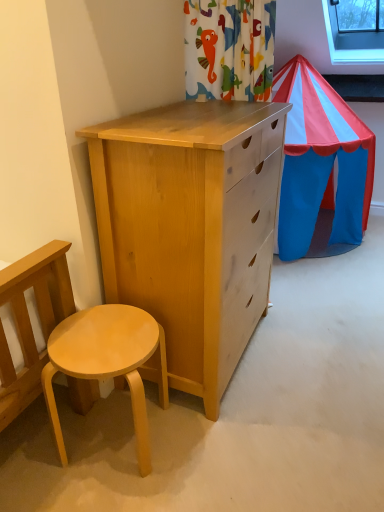
Question: Would you say light wood stool at lower left is a long distance from transparent glass window at upper right?

Choices:
 (A) no
 (B) yes

Answer: (B)

Question: Does light wood stool at lower left come in front of transparent glass window at upper right?

Choices:
 (A) yes
 (B) no

Answer: (A)

Question: Is light wood stool at lower left behind transparent glass window at upper right?

Choices:
 (A) no
 (B) yes

Answer: (A)

Question: Is light wood stool at lower left directly adjacent to transparent glass window at upper right?

Choices:
 (A) yes
 (B) no

Answer: (B)

Question: Does light wood stool at lower left have a greater width compared to transparent glass window at upper right?

Choices:
 (A) no
 (B) yes

Answer: (A)

Question: From a real-world perspective, is light wood stool at lower left physically below transparent glass window at upper right?

Choices:
 (A) no
 (B) yes

Answer: (B)

Question: Is transparent glass window at upper right positioned with its back to light wood stool at lower left?

Choices:
 (A) no
 (B) yes

Answer: (A)

Question: Considering the relative sizes of transparent glass window at upper right and light wood stool at lower left in the image provided, is transparent glass window at upper right wider than light wood stool at lower left?

Choices:
 (A) yes
 (B) no

Answer: (A)

Question: Considering the relative sizes of transparent glass window at upper right and light wood stool at lower left in the image provided, is transparent glass window at upper right smaller than light wood stool at lower left?

Choices:
 (A) yes
 (B) no

Answer: (B)

Question: From a real-world perspective, is transparent glass window at upper right located higher than light wood stool at lower left?

Choices:
 (A) no
 (B) yes

Answer: (B)

Question: Is the depth of transparent glass window at upper right greater than that of light wood stool at lower left?

Choices:
 (A) yes
 (B) no

Answer: (A)

Question: Is transparent glass window at upper right surrounding light wood stool at lower left?

Choices:
 (A) yes
 (B) no

Answer: (B)

Question: From the image's perspective, is transparent glass window at upper right located above or below light wood stool at lower left?

Choices:
 (A) below
 (B) above

Answer: (B)